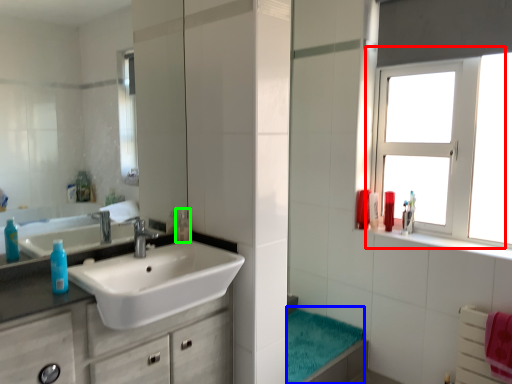
Question: Estimate the real-world distances between objects in this image. Which object is farther from window (highlighted by a red box), bath towel (highlighted by a blue box) or mouthwash (highlighted by a green box)?

Choices:
 (A) bath towel
 (B) mouthwash

Answer: (B)